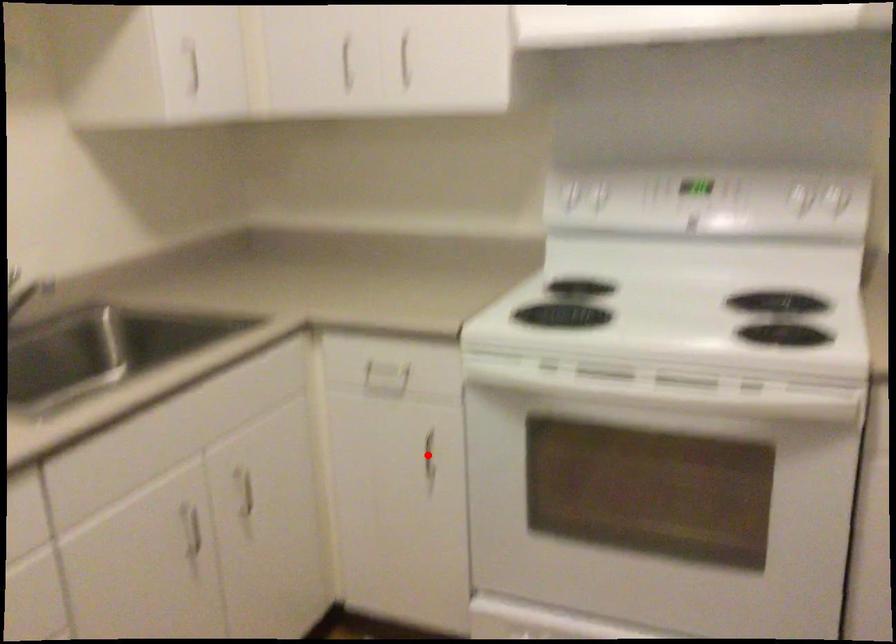
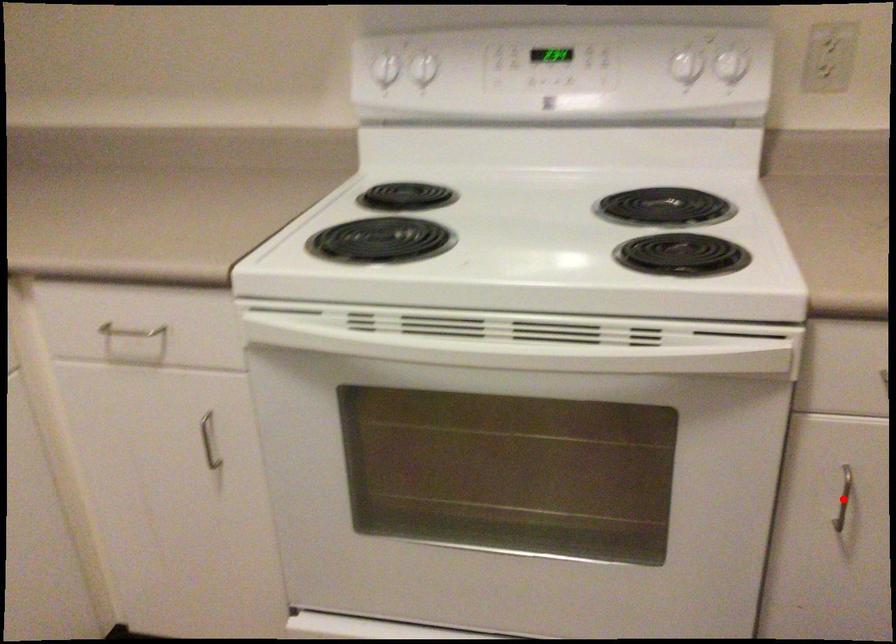
I am providing you with two images of the same scene from different viewpoints. A red point is marked on the first image and another point is marked on the second image. Does the point marked in image1 correspond to the same location as the one in image2?

No